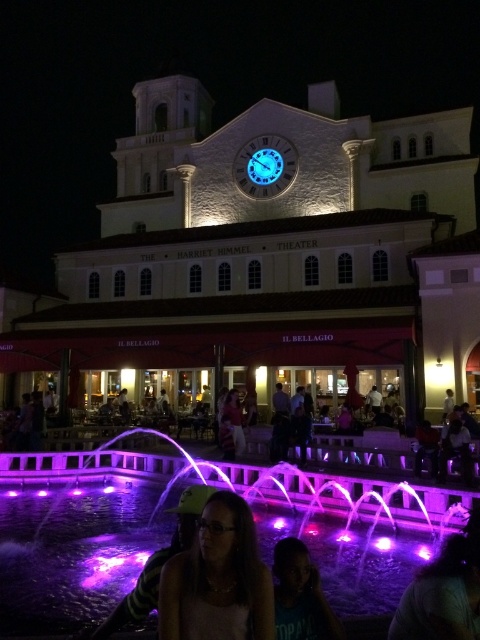
Between purple illuminated water at lower center and matte black dress at center, which one has less height?

With less height is matte black dress at center.

Where is `purple illuminated water at lower center`? The width and height of the screenshot is (480, 640). purple illuminated water at lower center is located at coordinates (79, 531).

Identify the location of purple illuminated water at lower center. Image resolution: width=480 pixels, height=640 pixels. (79, 531).

Is purple illuminated water at lower center thinner than blue glass clock at center?

Incorrect, purple illuminated water at lower center's width is not less than blue glass clock at center's.

Is point (257, 500) positioned after point (280, 145)?

No.

Image resolution: width=480 pixels, height=640 pixels. What are the coordinates of `purple illuminated water at lower center` in the screenshot? It's located at (79, 531).

How much distance is there between matte black dress at center and matte black hair at lower center?

matte black dress at center is 26.81 meters away from matte black hair at lower center.

Can you confirm if matte black dress at center is smaller than matte black hair at lower center?

Actually, matte black dress at center might be larger than matte black hair at lower center.

Between point (268, 445) and point (276, 620), which one is positioned behind?

The point (268, 445) is more distant.

The image size is (480, 640). Identify the location of matte black dress at center. (363, 452).